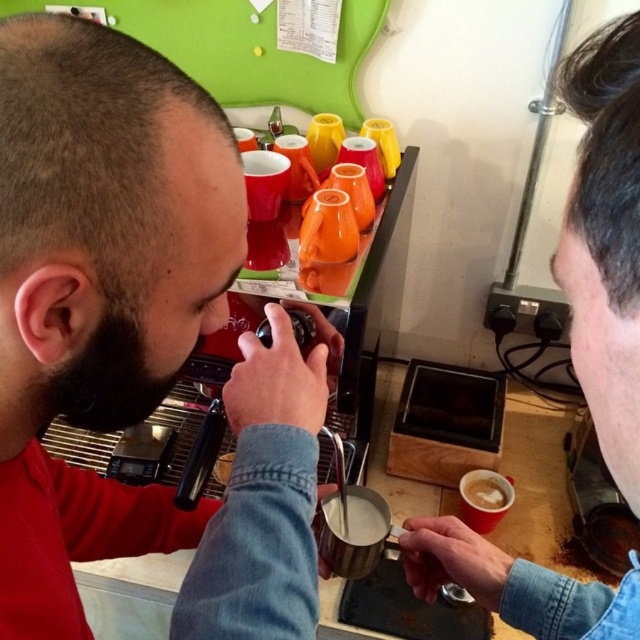
Question: Which of the following is the farthest from the observer?

Choices:
 (A) (288, 566)
 (B) (346, 522)
 (C) (486, 492)

Answer: (C)

Question: In this image, where is matte black espresso machine at center located relative to white frothy milk at center?

Choices:
 (A) left
 (B) right

Answer: (A)

Question: Does matte black espresso machine at center have a smaller size compared to black beard at left?

Choices:
 (A) yes
 (B) no

Answer: (B)

Question: Which object is farther from the camera taking this photo?

Choices:
 (A) matte black espresso machine at center
 (B) black beard at left

Answer: (B)

Question: Is matte black coffee cup at right positioned before white frothy milk at center?

Choices:
 (A) no
 (B) yes

Answer: (B)

Question: Among these points, which one is nearest to the camera?

Choices:
 (A) (492, 483)
 (B) (88, 387)
 (C) (481, 563)

Answer: (B)